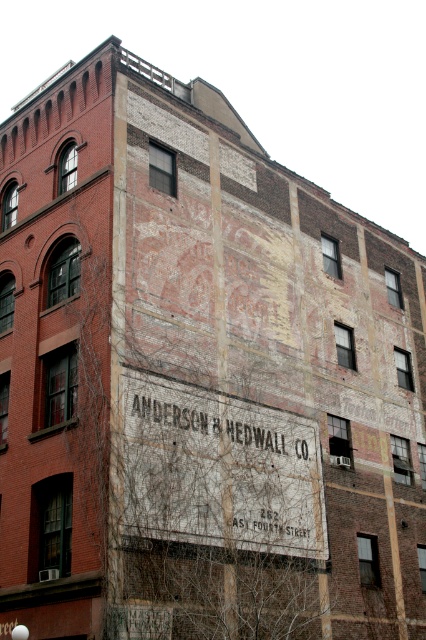
Looking at this image, you are a city planner analyzing the building facade. The white painted sign at center and the white faded sign at center are both present. Which one has a greater width?

The white painted sign at center has a greater width than the white faded sign at center as per the description.

You are a delivery person trying to find the correct address for Anderson and Hedwall Co. You see two signs on the building wall. The first is a white painted sign at center and the second is a white faded sign at center. Which sign is taller?

The white painted sign at center is much taller than the white faded sign at center.